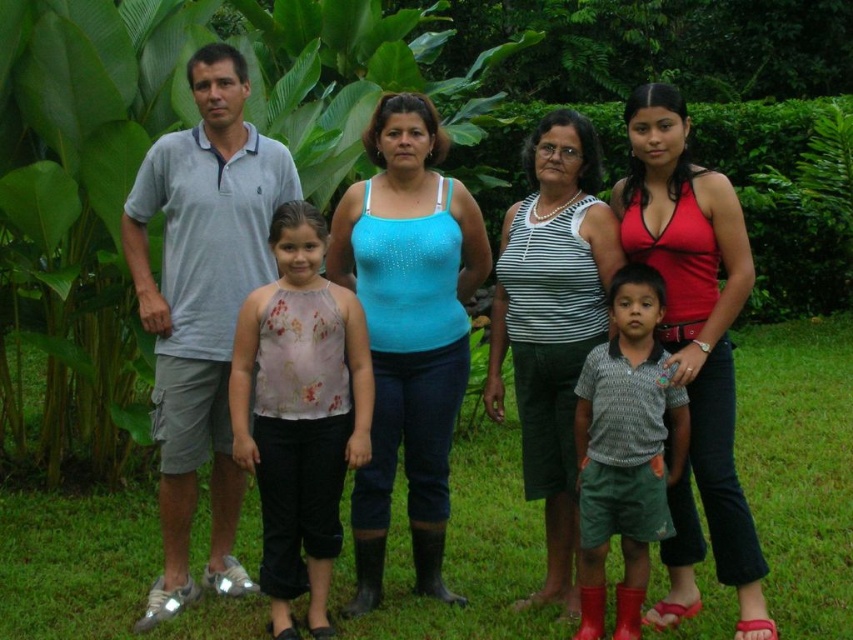
You are standing in the garden and want to place a small flower pot between the two points labeled point (589, 246) and point (595, 625). Which point should the flower pot be closer to in order to be closer to the camera?

The flower pot should be closer to point (589, 246) because it is closer to the camera than point (595, 625).